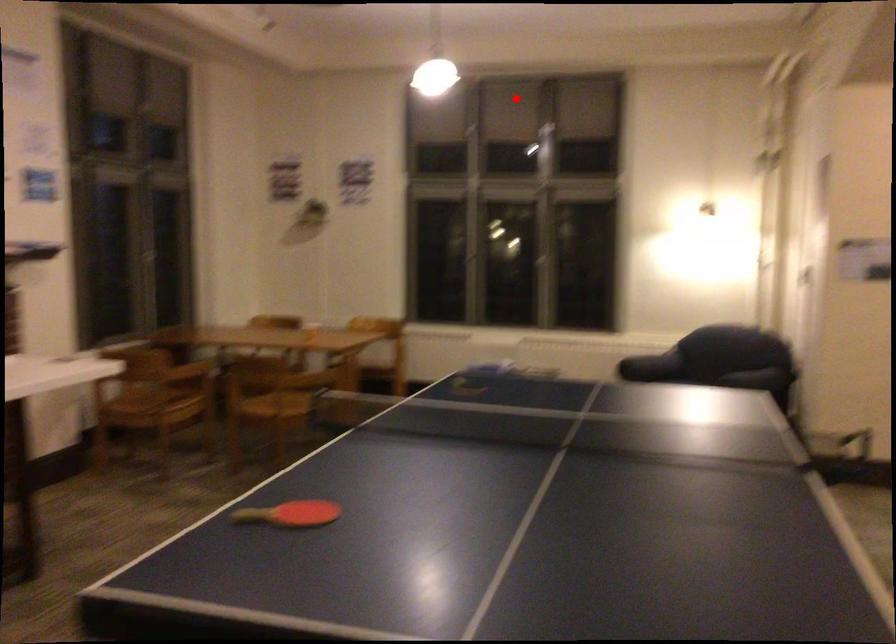
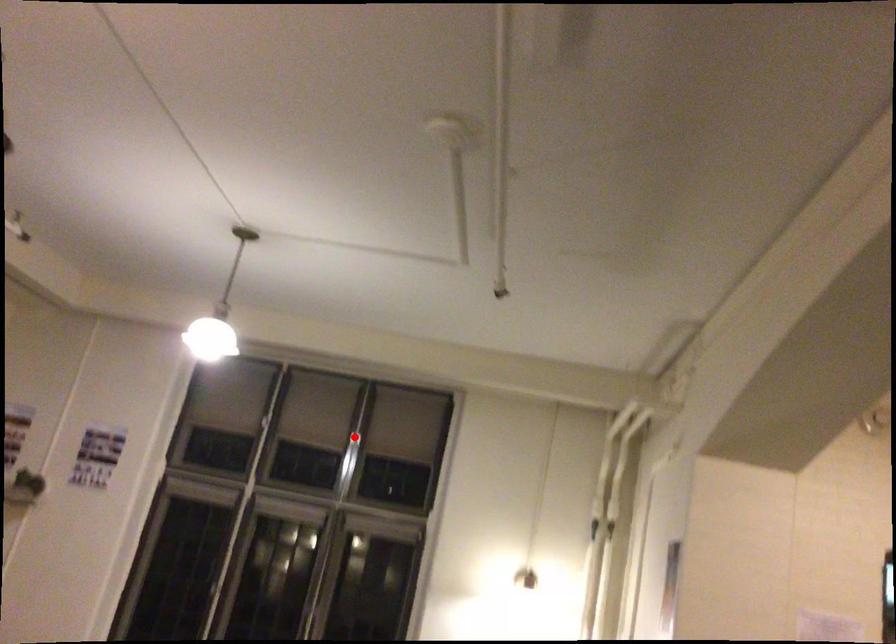
Based on the photo, I am providing you with two images of the same scene from different viewpoints. A red point is marked on the first image and another point is marked on the second image. Is the red point in image1 aligned with the point shown in image2?

Yes